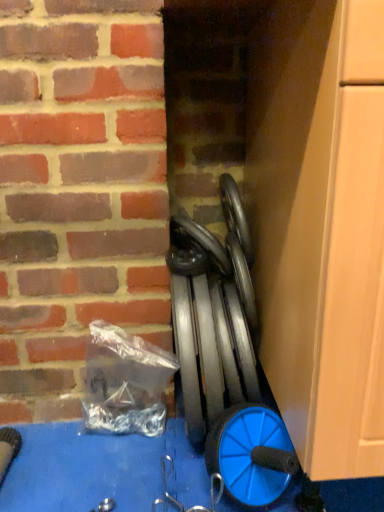
Question: Is blue plastic wheel at lower right situated inside black rubber car tire at center or outside?

Choices:
 (A) inside
 (B) outside

Answer: (B)

Question: From the image's perspective, is blue plastic wheel at lower right positioned above or below black rubber car tire at center?

Choices:
 (A) above
 (B) below

Answer: (B)

Question: Based on their relative distances, which object is farther from the metallic gray weights at center?

Choices:
 (A) blue plastic wheel at lower right
 (B) black rubber car tire at center

Answer: (B)

Question: Considering the real-world distances, which object is closest to the metallic gray weights at center?

Choices:
 (A) blue plastic wheel at lower right
 (B) black rubber car tire at center

Answer: (A)